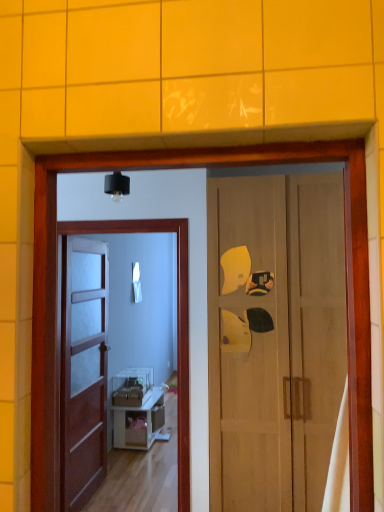
Question: Is clear glass screen door at center wider or thinner than white glossy mirror at center?

Choices:
 (A) wide
 (B) thin

Answer: (A)

Question: From a real-world perspective, is clear glass screen door at center positioned above or below white glossy mirror at center?

Choices:
 (A) above
 (B) below

Answer: (B)

Question: Estimate the real-world distances between objects in this image. Which object is closer to the brown wooden door at center, marked as the 2th door in a right-to-left arrangement?

Choices:
 (A) white glossy cabinet at center
 (B) wooden door at right, which ranks as the 1th door in right-to-left order
 (C) clear glass screen door at center
 (D) white glossy mirror at center

Answer: (A)

Question: Considering the real-world distances, which object is closest to the white glossy cabinet at center?

Choices:
 (A) clear glass screen door at center
 (B) wooden door at right, the 2th door positioned from the left
 (C) white glossy mirror at center
 (D) brown wooden door at center, marked as the 2th door in a right-to-left arrangement

Answer: (D)